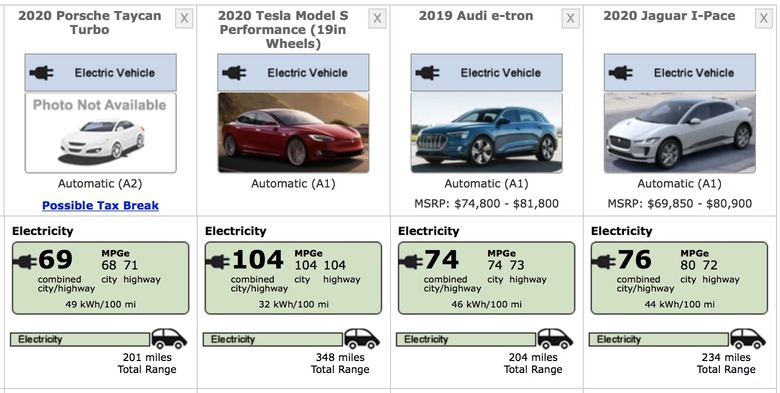
You are a GUI agent. You are given a task and a screenshot of the screen. Output one action in this format:
    pyautogui.click(x=<x>, y=<y>)
    Task: Click on the window shields
    The image size is (780, 393).
    Given the screenshot: What is the action you would take?
    pyautogui.click(x=664, y=114), pyautogui.click(x=488, y=113), pyautogui.click(x=293, y=117), pyautogui.click(x=104, y=128)